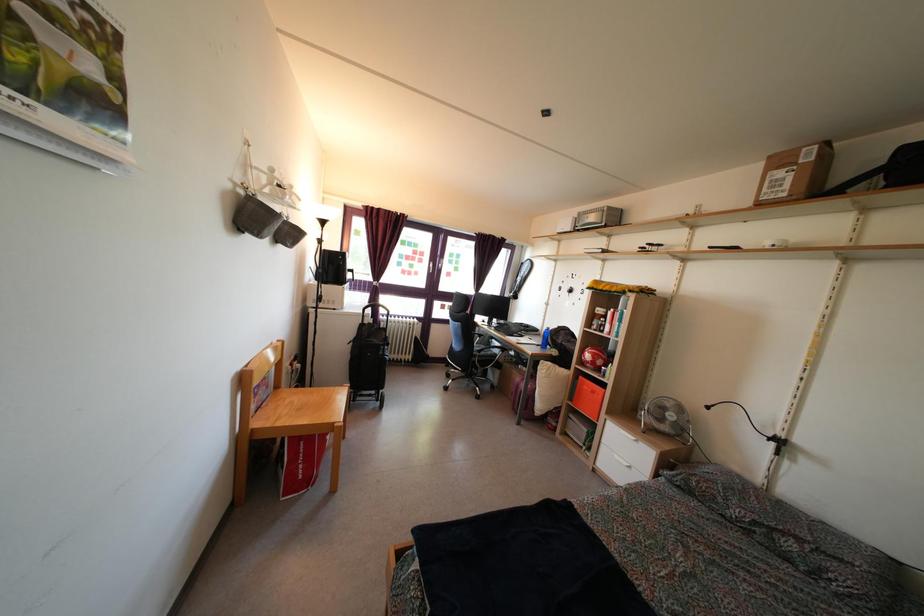
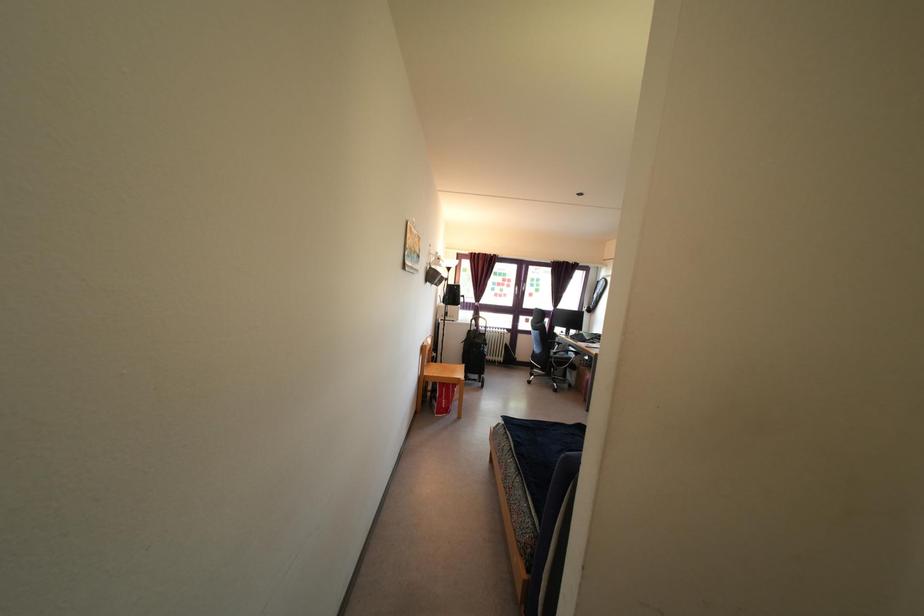
Where in the second image is the point corresponding to (482,360) from the first image?

(557, 362)